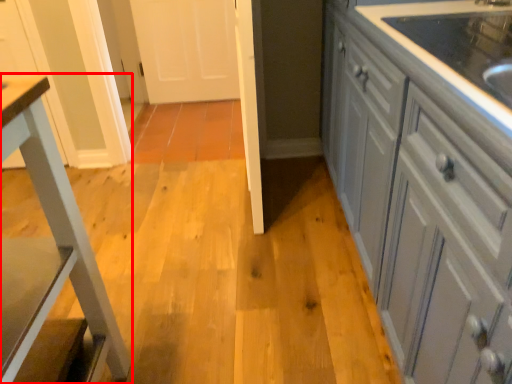
Question: From the image's perspective, where is furniture (annotated by the red box) located in relation to cabinetry in the image?

Choices:
 (A) above
 (B) below

Answer: (B)